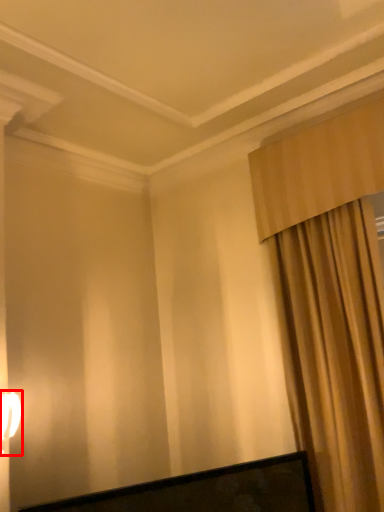
Question: Observing the image, what is the correct spatial positioning of table lamp (annotated by the red box) in reference to curtain?

Choices:
 (A) right
 (B) left

Answer: (B)